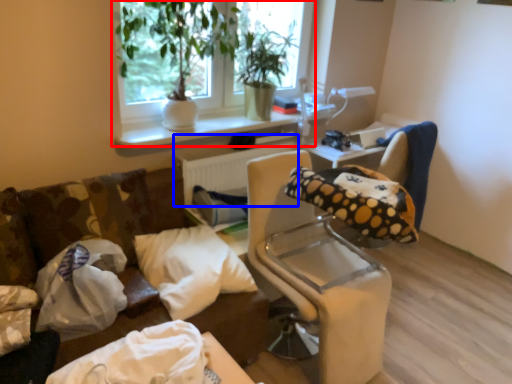
Question: Which object is closer to the camera taking this photo, window (highlighted by a red box) or radiator (highlighted by a blue box)?

Choices:
 (A) window
 (B) radiator

Answer: (A)